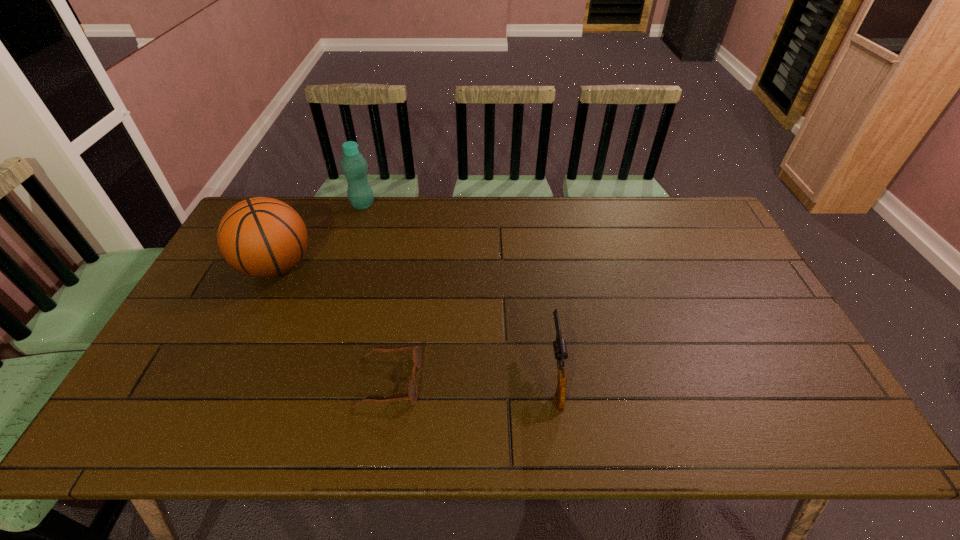
Where is `free region at the left edge`? The width and height of the screenshot is (960, 540). free region at the left edge is located at coordinates (252, 299).

Identify the location of vacant space at the right edge of the desktop. The width and height of the screenshot is (960, 540). (724, 259).

Where is `empty space between the basketball and the third tallest object`? The height and width of the screenshot is (540, 960). empty space between the basketball and the third tallest object is located at coordinates (416, 320).

The image size is (960, 540). In order to click on free space between the shortest object and the second object from left to right in this screenshot , I will do `click(375, 293)`.

Locate an element on the screen. Image resolution: width=960 pixels, height=540 pixels. empty space that is in between the second farthest object and the second object from right to left is located at coordinates (333, 323).

Locate an element on the screen. unoccupied area between the basketball and the second object from left to right is located at coordinates (320, 235).

This screenshot has height=540, width=960. I want to click on free space between the farthest object and the third object from left to right, so click(375, 293).

The image size is (960, 540). Identify the location of free space between the shortest object and the third tallest object. (472, 377).

Identify the location of vacant space in between the spectacles and the leftmost object. Image resolution: width=960 pixels, height=540 pixels. (333, 323).

Locate an element on the screen. The image size is (960, 540). free space between the third object from left to right and the third nearest object is located at coordinates (333, 323).